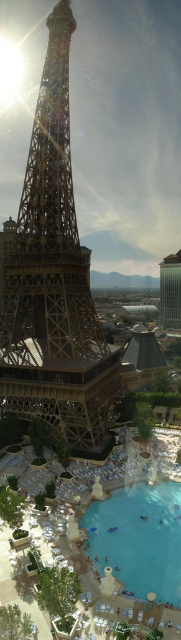
You are standing in front of the golden metallic eiffel tower at center and the green glass tower at upper center. Which one would you have to look up more to see?

The green glass tower at upper center requires looking up more because it is further away from the viewer compared to the golden metallic eiffel tower at center.

You are standing at the point with coordinates [53,280] in the image. What object are you directly facing?

The point at coordinates [53,280] directly faces the golden metallic Eiffel Tower at center, so you are directly facing the golden metallic Eiffel Tower at center.

You are standing at the edge of the pool and want to take a photo of the golden metallic eiffel tower at center without the clear blue water at lower center appearing in the frame. Is this possible?

The golden metallic eiffel tower at center is above the clear blue water at lower center, so yes, you can position yourself to capture the tower without the water in the frame by angling the camera upwards.